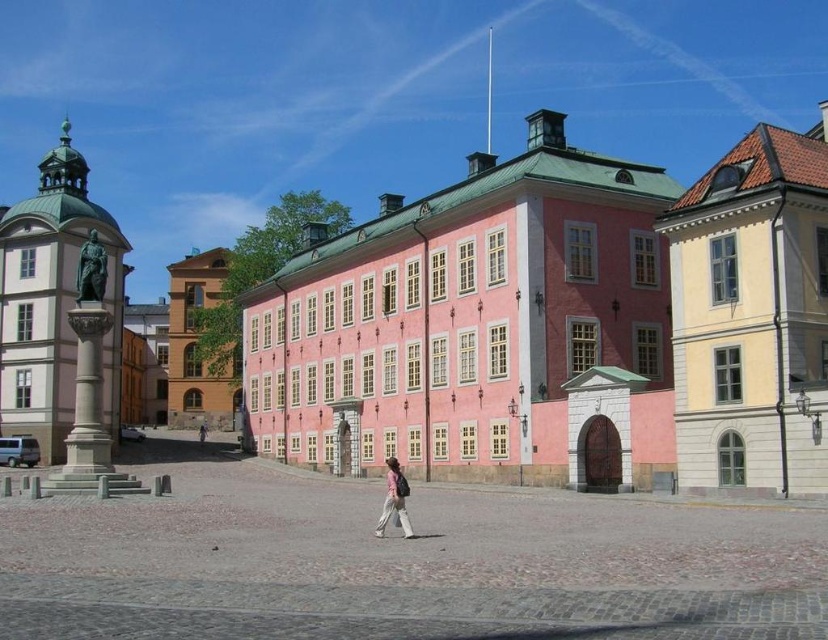
Does pink matte building at center appear on the left side of green patina statue at left?

In fact, pink matte building at center is to the right of green patina statue at left.

Is point (335, 378) more distant than point (97, 280)?

Yes, point (335, 378) is behind point (97, 280).

Where is `pink matte building at center`? This screenshot has width=828, height=640. pink matte building at center is located at coordinates (469, 323).

Does pink matte building at center lie in front of yellow matte building at upper right?

No, pink matte building at center is behind yellow matte building at upper right.

Between pink matte building at center and yellow matte building at upper right, which one has more height?

yellow matte building at upper right is taller.

Is point (407, 264) farther from camera compared to point (764, 435)?

Yes, point (407, 264) is farther from viewer.

Where is `pink matte building at center`? This screenshot has height=640, width=828. pink matte building at center is located at coordinates (469, 323).

Does polished bronze statue at left have a lesser height compared to light brown leather jacket at center?

Incorrect, polished bronze statue at left's height does not fall short of light brown leather jacket at center's.

Who is positioned more to the left, polished bronze statue at left or light brown leather jacket at center?

From the viewer's perspective, polished bronze statue at left appears more on the left side.

What do you see at coordinates (54, 301) in the screenshot? I see `polished bronze statue at left` at bounding box center [54, 301].

Where is `polished bronze statue at left`? This screenshot has height=640, width=828. polished bronze statue at left is located at coordinates (54, 301).